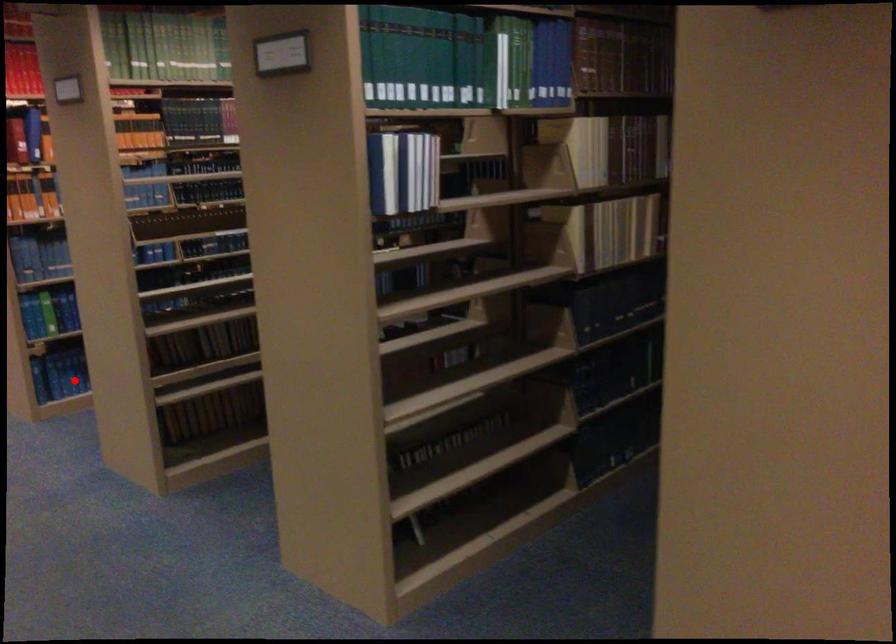
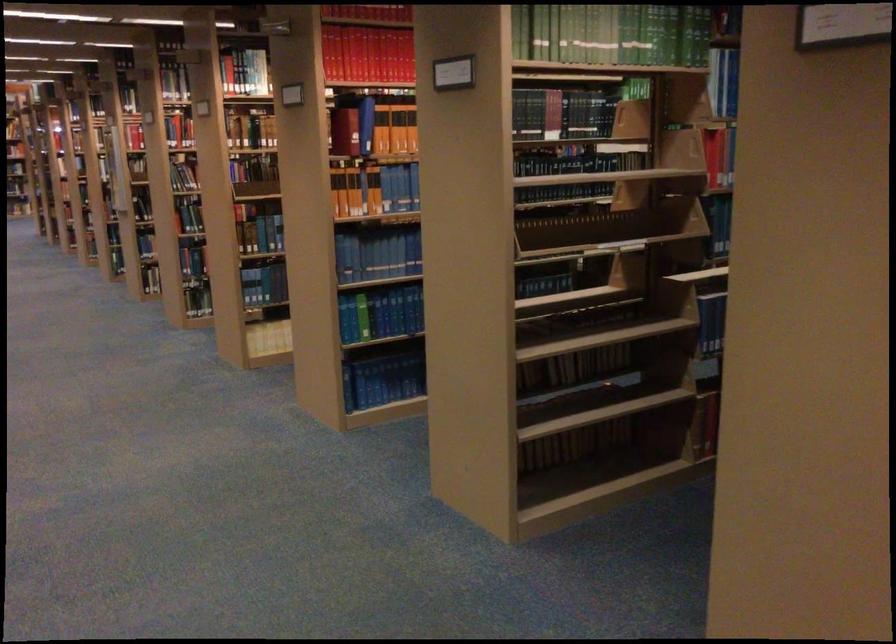
Find the pixel in the second image that matches the highlighted location in the first image.

(383, 380)